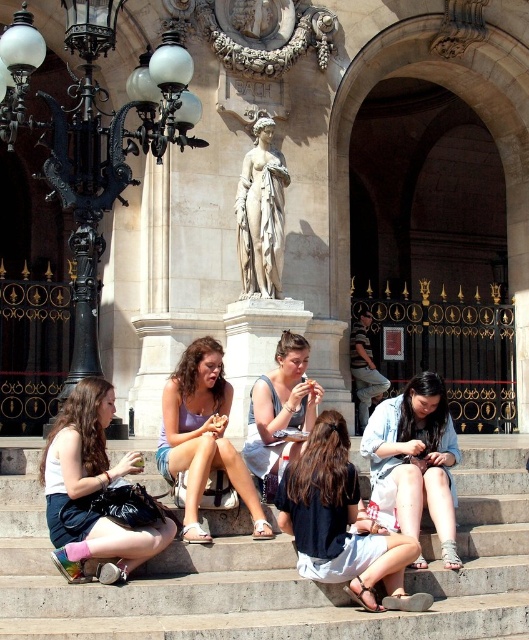
Question: Does light gray concrete stairs at center appear over matte white tank top at lower left?

Choices:
 (A) yes
 (B) no

Answer: (B)

Question: Is matte white tank top at lower left thinner than light blue denim shorts at center?

Choices:
 (A) yes
 (B) no

Answer: (B)

Question: Which point is farther from the camera taking this photo?

Choices:
 (A) (339, 493)
 (B) (112, 586)
 (C) (296, 442)
 (D) (162, 410)

Answer: (D)

Question: Which object appears closest to the camera in this image?

Choices:
 (A) dark blue denim skirt at center
 (B) white marble statue at center
 (C) matte white tank top at lower left
 (D) light blue denim shirt at center

Answer: (C)

Question: Estimate the real-world distances between objects in this image. Which object is farther from the light blue denim shirt at center?

Choices:
 (A) white marble statue at center
 (B) matte white tank top at lower left

Answer: (A)

Question: Does light gray concrete stairs at center have a greater width compared to dark blue denim skirt at center?

Choices:
 (A) yes
 (B) no

Answer: (A)